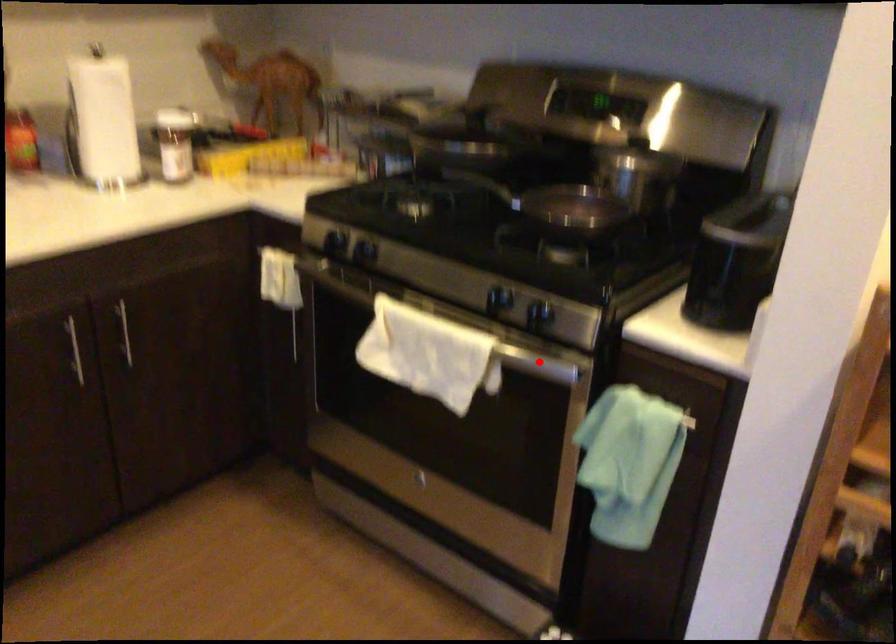
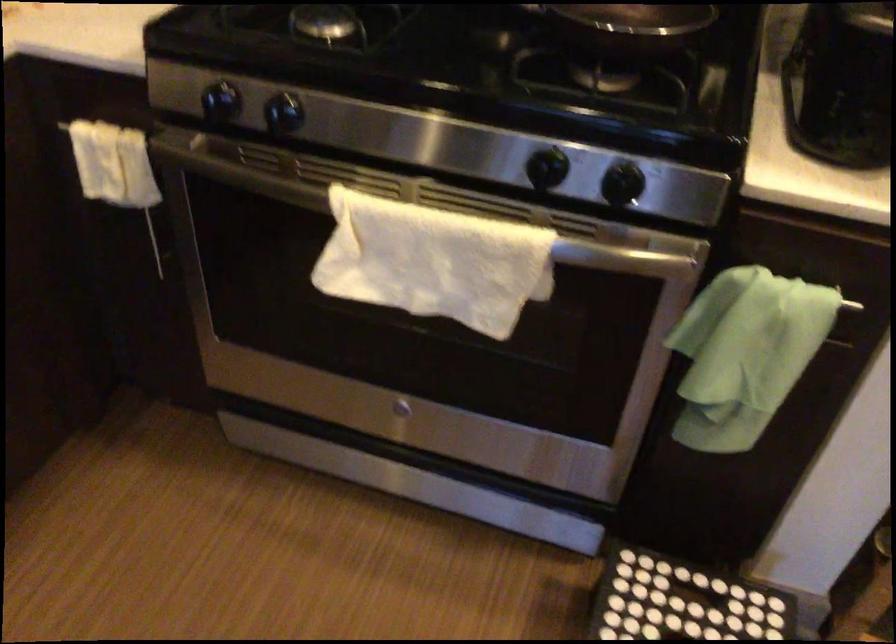
Question: A red point is marked in image1. In image2, is the corresponding 3D point closer to the camera or farther? Reply with the corresponding letter.

Choices:
 (A) The corresponding 3D point is closer.
 (B) The corresponding 3D point is farther.

Answer: (A)